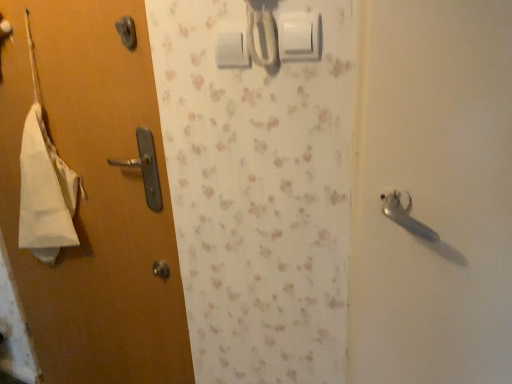
Question: From their relative heights in the image, would you say matte wood door at left is taller or shorter than white plastic light switch at upper center, which is the 1th light switch in back-to-front order?

Choices:
 (A) tall
 (B) short

Answer: (A)

Question: From a real-world perspective, is matte wood door at left above or below white plastic light switch at upper center, which is the 1th light switch in back-to-front order?

Choices:
 (A) below
 (B) above

Answer: (A)

Question: Which is farther from the white plastic light switch at upper center, arranged as the second light switch when viewed from the front?

Choices:
 (A) white plastic light switch at upper center, acting as the first light switch starting from the right
 (B) matte wood door at left

Answer: (B)

Question: Which is farther from the white plastic light switch at upper center, the 2th light switch in the left-to-right sequence?

Choices:
 (A) matte wood door at left
 (B) white plastic light switch at upper center, arranged as the second light switch when viewed from the front

Answer: (A)